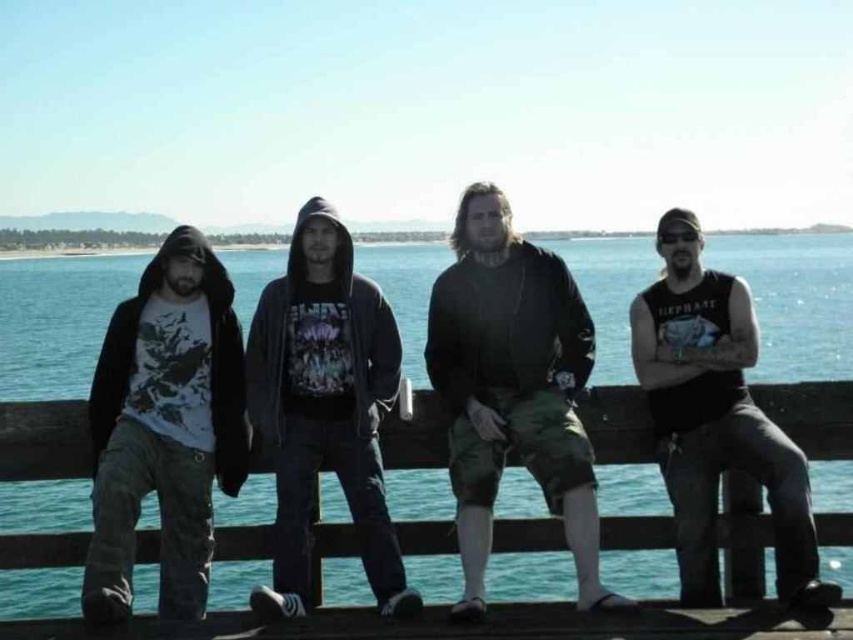
This screenshot has width=853, height=640. Describe the element at coordinates (512, 388) in the screenshot. I see `dark green camo shorts at center` at that location.

Based on the photo, who is more forward, (577, 476) or (285, 481)?

Point (577, 476) is in front.

Is point (474, 301) positioned after point (364, 449)?

Yes, it is.

Locate an element on the screen. Image resolution: width=853 pixels, height=640 pixels. dark green camo shorts at center is located at coordinates (512, 388).

Is point (102, 396) positioned before point (631, 342)?

Yes, it is.

Does matte black hoodie at left appear under black tank top at right?

Indeed, matte black hoodie at left is positioned under black tank top at right.

Does point (202, 349) come farther from viewer compared to point (670, 296)?

That is False.

Image resolution: width=853 pixels, height=640 pixels. I want to click on matte black hoodie at left, so pyautogui.click(x=165, y=428).

Between dark green camo shorts at center and black tank top at right, which one is positioned lower?

dark green camo shorts at center

Which is more to the left, dark green camo shorts at center or black tank top at right?

From the viewer's perspective, dark green camo shorts at center appears more on the left side.

Is point (474, 522) farther from camera compared to point (706, 586)?

Yes.

You are a GUI agent. You are given a task and a screenshot of the screen. Output one action in this format:
    pyautogui.click(x=<x>, y=<y>)
    Task: Click on the dark green camo shorts at center
    The width and height of the screenshot is (853, 640).
    Given the screenshot: What is the action you would take?
    pyautogui.click(x=512, y=388)